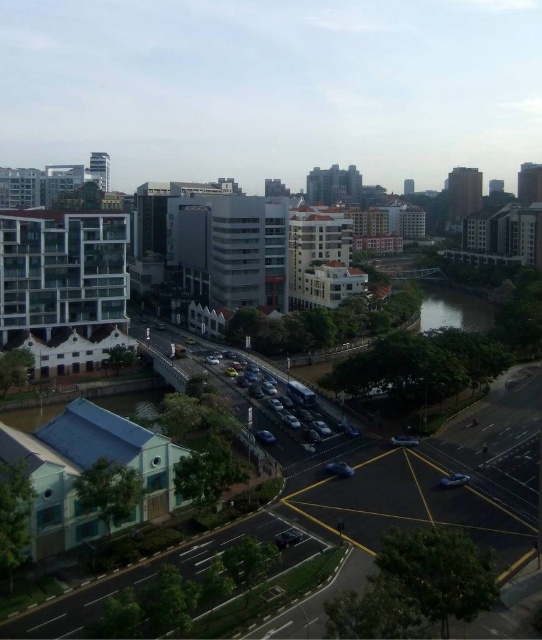
Is shiny black car at center in front of shiny silver sedan at center?

That is True.

Where is `shiny black car at center`? shiny black car at center is located at coordinates (288, 538).

Measure the distance between point (442, 480) and camera.

Point (442, 480) and camera are 81.67 meters apart.

Can you confirm if shiny blue sedan at lower right is positioned to the right of shiny blue sedan at center?

Correct, you'll find shiny blue sedan at lower right to the right of shiny blue sedan at center.

The image size is (542, 640). What do you see at coordinates (454, 481) in the screenshot?
I see `shiny blue sedan at lower right` at bounding box center [454, 481].

Image resolution: width=542 pixels, height=640 pixels. Find the location of `shiny blue sedan at lower right`. shiny blue sedan at lower right is located at coordinates (454, 481).

Is shiny blue sedan at center above metallic blue sedan at center?

Incorrect, shiny blue sedan at center is not positioned above metallic blue sedan at center.

Between point (327, 465) and point (255, 438), which one is positioned in front?

Point (327, 465) is in front.

Measure the distance between shiny blue sedan at center and camera.

The distance of shiny blue sedan at center from camera is 82.57 meters.

This screenshot has height=640, width=542. Identify the location of shiny blue sedan at center. (339, 468).